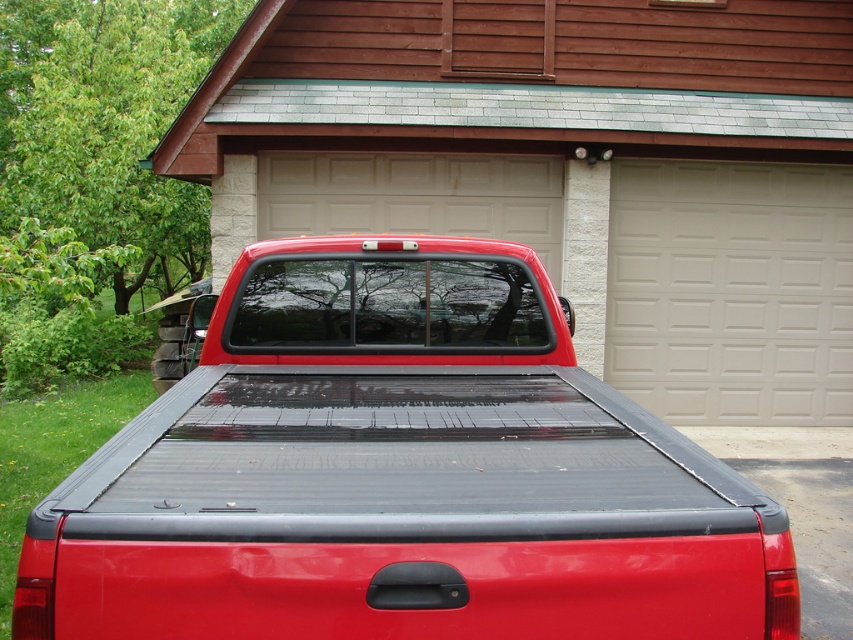
Can you confirm if white textured panel at center is taller than black rubber mat at lower right?

Yes, white textured panel at center is taller than black rubber mat at lower right.

Which is in front, point (749, 241) or point (843, 532)?

Point (843, 532) is in front.

This screenshot has width=853, height=640. Describe the element at coordinates (730, 291) in the screenshot. I see `white textured panel at center` at that location.

I want to click on white textured panel at center, so click(730, 291).

In the scene shown: Does matte black truck bed at center appear under white textured panel at center?

Yes.

Consider the image. Who is taller, matte black truck bed at center or white textured panel at center?

Standing taller between the two is white textured panel at center.

Measure the distance between matte black truck bed at center and camera.

matte black truck bed at center and camera are 4.66 feet apart from each other.

Identify the location of matte black truck bed at center. (399, 474).

Is matte black truck bed at center positioned before black rubber mat at lower right?

Yes, it is in front of black rubber mat at lower right.

This screenshot has height=640, width=853. What do you see at coordinates (399, 474) in the screenshot? I see `matte black truck bed at center` at bounding box center [399, 474].

Locate an element on the screen. Image resolution: width=853 pixels, height=640 pixels. matte black truck bed at center is located at coordinates (399, 474).